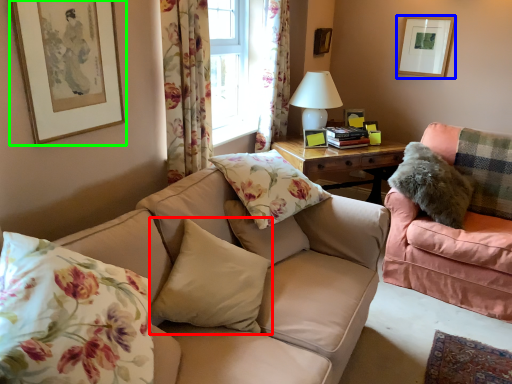
Question: Considering the real-world distances, which object is farthest from pillow (highlighted by a red box)? picture frame (highlighted by a blue box) or picture frame (highlighted by a green box)?

Choices:
 (A) picture frame
 (B) picture frame

Answer: (A)